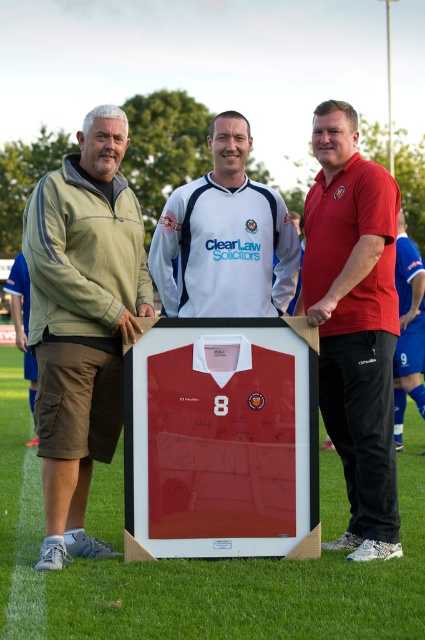
Question: Estimate the real-world distances between objects in this image. Which object is farther from the white jersey at center?

Choices:
 (A) smooth glass frame at center
 (B) blue jersey at center

Answer: (B)

Question: Does smooth glass frame at center have a smaller size compared to blue jersey at center?

Choices:
 (A) yes
 (B) no

Answer: (B)

Question: Does smooth glass frame at center come behind white jersey at center?

Choices:
 (A) no
 (B) yes

Answer: (A)

Question: Which point is farther to the camera?

Choices:
 (A) white jersey at center
 (B) blue jersey at center
 (C) matte red polo shirt at center
 (D) smooth glass frame at center

Answer: (B)

Question: Considering the relative positions of matte red polo shirt at center and white jersey at center in the image provided, where is matte red polo shirt at center located with respect to white jersey at center?

Choices:
 (A) left
 (B) right

Answer: (B)

Question: Which of these objects is positioned farthest from the green fabric pants at left?

Choices:
 (A) matte red polo shirt at center
 (B) matte red jersey at center
 (C) blue jersey at center
 (D) white jersey at center

Answer: (C)